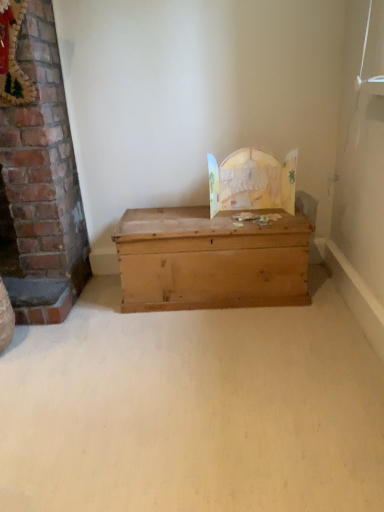
At what (x,y) coordinates should I click in order to perform the action: click on free space to the right of brick fireplace at left. Please return your answer as a coordinate pair (x, y). Looking at the image, I should click on (109, 284).